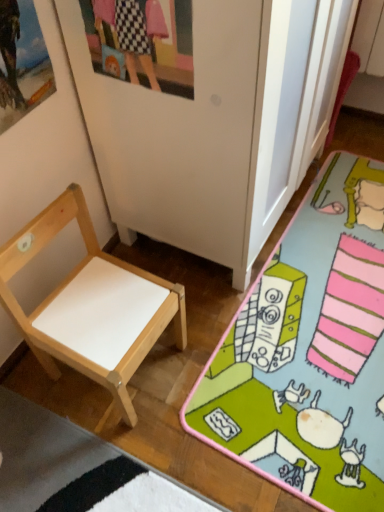
Question: Would you say wooden picture frame at upper left, which ranks as the 1th picture frame in left-to-right order, is outside natural wood chair at left?

Choices:
 (A) no
 (B) yes

Answer: (B)

Question: Can you confirm if wooden picture frame at upper left, the 2th picture frame from the right, is positioned to the right of natural wood chair at left?

Choices:
 (A) no
 (B) yes

Answer: (A)

Question: From a real-world perspective, is wooden picture frame at upper left, the 2th picture frame from the right, beneath natural wood chair at left?

Choices:
 (A) no
 (B) yes

Answer: (A)

Question: From the image's perspective, is wooden picture frame at upper left, which ranks as the 1th picture frame in left-to-right order, on top of natural wood chair at left?

Choices:
 (A) yes
 (B) no

Answer: (A)

Question: Is wooden picture frame at upper left, which ranks as the 1th picture frame in left-to-right order, touching natural wood chair at left?

Choices:
 (A) no
 (B) yes

Answer: (A)

Question: Is point (36, 220) closer or farther from the camera than point (107, 74)?

Choices:
 (A) closer
 (B) farther

Answer: (A)

Question: From the image's perspective, relative to matte plastic picture frame at upper center, the 1th picture frame from the right, is natural wood chair at left above or below?

Choices:
 (A) below
 (B) above

Answer: (A)

Question: Considering their positions, is natural wood chair at left located in front of or behind matte plastic picture frame at upper center, which is the 2th picture frame in left-to-right order?

Choices:
 (A) front
 (B) behind

Answer: (B)

Question: Is natural wood chair at left wider or thinner than matte plastic picture frame at upper center, the 1th picture frame from the right?

Choices:
 (A) thin
 (B) wide

Answer: (B)

Question: Considering the positions of point tap(99, 71) and point tap(183, 422), is point tap(99, 71) closer or farther from the camera than point tap(183, 422)?

Choices:
 (A) closer
 (B) farther

Answer: (A)

Question: Relative to white matte desk at lower left, is matte plastic picture frame at upper center, the 1th picture frame from the right, in front or behind?

Choices:
 (A) behind
 (B) front

Answer: (B)

Question: In terms of width, does matte plastic picture frame at upper center, which is the 2th picture frame in left-to-right order, look wider or thinner when compared to white matte desk at lower left?

Choices:
 (A) thin
 (B) wide

Answer: (A)

Question: From the image's perspective, is matte plastic picture frame at upper center, the 1th picture frame from the right, located above or below white matte desk at lower left?

Choices:
 (A) below
 (B) above

Answer: (B)

Question: Considering the positions of wooden picture frame at upper left, which ranks as the 1th picture frame in left-to-right order, and matte plastic picture frame at upper center, the 1th picture frame from the right, in the image, is wooden picture frame at upper left, which ranks as the 1th picture frame in left-to-right order, bigger or smaller than matte plastic picture frame at upper center, the 1th picture frame from the right,?

Choices:
 (A) big
 (B) small

Answer: (A)

Question: In terms of width, does wooden picture frame at upper left, the 2th picture frame from the right, look wider or thinner when compared to matte plastic picture frame at upper center, the 1th picture frame from the right?

Choices:
 (A) wide
 (B) thin

Answer: (A)